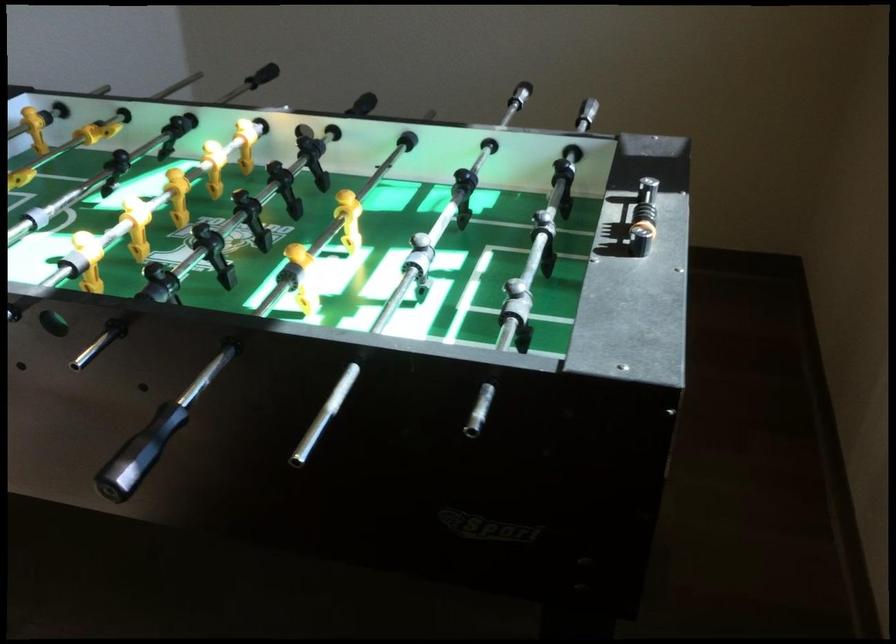
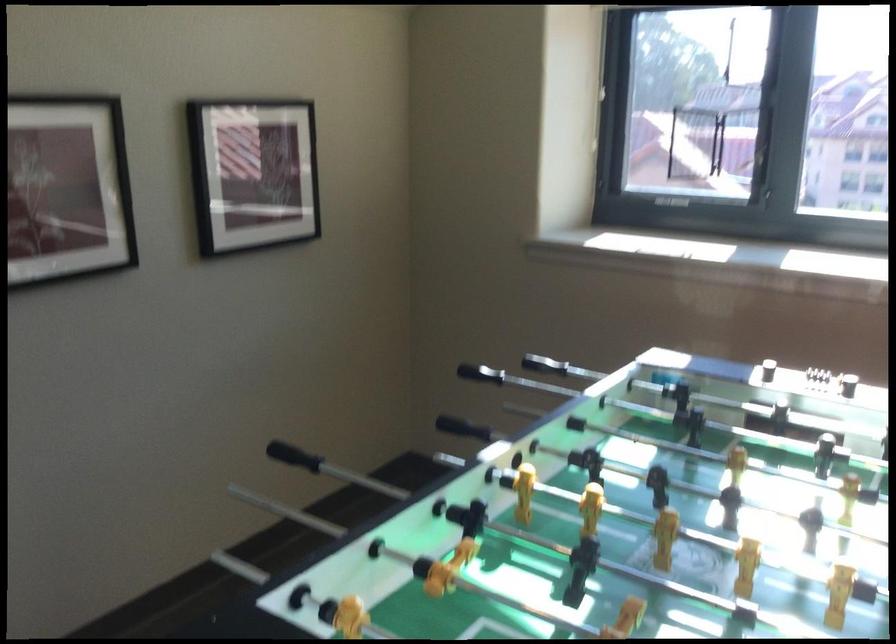
Find the pixel in the second image that matches pixel 807 240 in the first image.

(463, 428)